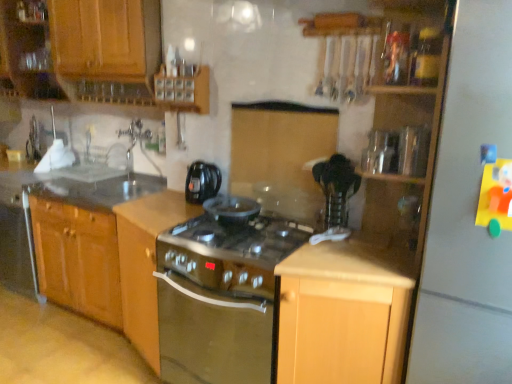
What do you see at coordinates (343, 313) in the screenshot?
I see `light wood cabinet at center, the 4th cabinetry when ordered from left to right` at bounding box center [343, 313].

Identify the location of wooden spice rack at upper center, which is the third cabinetry in left-to-right order. The height and width of the screenshot is (384, 512). (183, 90).

What is the approximate width of clear glass sink at upper left?

12.14 inches.

Identify the location of black plastic kettle at center. (202, 182).

Where is `smooth granite countertop at left`? The height and width of the screenshot is (384, 512). smooth granite countertop at left is located at coordinates (79, 185).

Locate an element on the screen. This screenshot has width=512, height=384. light wood cabinet at center, the first cabinetry in the right-to-left sequence is located at coordinates (343, 313).

In the scene shown: From the image's perspective, who appears lower, wooden cabinet at upper left, positioned as the first cabinetry in left-to-right order, or black plastic kettle at center?

black plastic kettle at center appears lower in the image.

Is wooden cabinet at upper left, which is the fourth cabinetry in right-to-left order, inside the boundaries of black plastic kettle at center, or outside?

wooden cabinet at upper left, which is the fourth cabinetry in right-to-left order, exists outside the volume of black plastic kettle at center.

From a real-world perspective, who is located higher, wooden cabinet at upper left, which is the fourth cabinetry in right-to-left order, or black plastic kettle at center?

From a 3D spatial view, wooden cabinet at upper left, which is the fourth cabinetry in right-to-left order, is above.

Between satin silver oven at center and black plastic kettle at center, which one has larger size?

With larger size is satin silver oven at center.

From a real-world perspective, is satin silver oven at center on black plastic kettle at center?

No, from a real-world perspective, satin silver oven at center is not over black plastic kettle at center

Is black plastic kettle at center at the back of satin silver oven at center?

No, satin silver oven at center is not facing away from black plastic kettle at center.

You are a GUI agent. You are given a task and a screenshot of the screen. Output one action in this format:
    pyautogui.click(x=<x>, y=<y>)
    Task: Click on the oven lying on the right of black plastic kettle at center
    The image size is (512, 384).
    Given the screenshot: What is the action you would take?
    pyautogui.click(x=222, y=298)

Are light wood cabinet at center, the 4th cabinetry when ordered from left to right, and clear plastic container at upper right, which is the first appliance in front-to-back order, making contact?

light wood cabinet at center, the 4th cabinetry when ordered from left to right, and clear plastic container at upper right, which is the first appliance in front-to-back order, are clearly separated.

Starting from the light wood cabinet at center, the first cabinetry in the right-to-left sequence, which appliance is the 2nd one to the right? Please provide its 2D coordinates.

[(413, 151)]

Is satin wood stove at center, which appears as the second cabinetry when viewed from the left, closer to camera compared to smooth granite countertop at left?

Yes, satin wood stove at center, which appears as the second cabinetry when viewed from the left, is closer to the viewer.

From the image's perspective, would you say satin wood stove at center, which ranks as the 3th cabinetry in right-to-left order, is positioned over smooth granite countertop at left?

No, from the image's perspective, satin wood stove at center, which ranks as the 3th cabinetry in right-to-left order, is not above smooth granite countertop at left.

From a real-world perspective, is satin wood stove at center, which appears as the second cabinetry when viewed from the left, physically above smooth granite countertop at left?

No, from a real-world perspective, satin wood stove at center, which appears as the second cabinetry when viewed from the left, is not on top of smooth granite countertop at left.

Between satin wood stove at center, which appears as the second cabinetry when viewed from the left, and smooth granite countertop at left, which one has less height?

smooth granite countertop at left is shorter.

How much distance is there between satin wood stove at center, which ranks as the 3th cabinetry in right-to-left order, and wooden cabinet at upper left, which is the fourth cabinetry in right-to-left order?

The distance of satin wood stove at center, which ranks as the 3th cabinetry in right-to-left order, from wooden cabinet at upper left, which is the fourth cabinetry in right-to-left order, is 35.46 inches.

From the image's perspective, which one is positioned higher, satin wood stove at center, which ranks as the 3th cabinetry in right-to-left order, or wooden cabinet at upper left, positioned as the first cabinetry in left-to-right order?

Result: From the image's view, wooden cabinet at upper left, positioned as the first cabinetry in left-to-right order, is above.

Is point (180, 207) less distant than point (14, 18)?

Yes, it is in front of point (14, 18).

Would you consider satin wood stove at center, which ranks as the 3th cabinetry in right-to-left order, to be distant from wooden cabinet at upper left, positioned as the first cabinetry in left-to-right order?

No, satin wood stove at center, which ranks as the 3th cabinetry in right-to-left order, is not far from wooden cabinet at upper left, positioned as the first cabinetry in left-to-right order.

Looking at their sizes, would you say satin wood stove at center, which ranks as the 3th cabinetry in right-to-left order, is wider or thinner than white matte refrigerator at right?

Clearly, satin wood stove at center, which ranks as the 3th cabinetry in right-to-left order, has less width compared to white matte refrigerator at right.

Which is less distant, (138, 216) or (444, 263)?

Positioned in front is point (444, 263).

Is satin wood stove at center, which ranks as the 3th cabinetry in right-to-left order, not near white matte refrigerator at right?

That's right, there is a large distance between satin wood stove at center, which ranks as the 3th cabinetry in right-to-left order, and white matte refrigerator at right.

Considering the positions of objects wooden spice rack at upper center, which is the 2th cabinetry from right to left, and satin wood stove at center, which ranks as the 3th cabinetry in right-to-left order, in the image provided, who is more to the left, wooden spice rack at upper center, which is the 2th cabinetry from right to left, or satin wood stove at center, which ranks as the 3th cabinetry in right-to-left order,?

satin wood stove at center, which ranks as the 3th cabinetry in right-to-left order.

Is wooden spice rack at upper center, which is the third cabinetry in left-to-right order, not close to satin wood stove at center, which ranks as the 3th cabinetry in right-to-left order?

No, wooden spice rack at upper center, which is the third cabinetry in left-to-right order, is not far away from satin wood stove at center, which ranks as the 3th cabinetry in right-to-left order.

Which object is closer to the camera taking this photo, wooden spice rack at upper center, which is the third cabinetry in left-to-right order, or satin wood stove at center, which appears as the second cabinetry when viewed from the left?

Positioned in front is satin wood stove at center, which appears as the second cabinetry when viewed from the left.

Between wooden spice rack at upper center, which is the third cabinetry in left-to-right order, and satin wood stove at center, which ranks as the 3th cabinetry in right-to-left order, which one has less height?

wooden spice rack at upper center, which is the third cabinetry in left-to-right order.

At what (x,y) coordinates should I click in order to perform the action: click on kitchen appliance on the right side of wooden cabinet at upper left, which is the fourth cabinetry in right-to-left order. Please return your answer as a coordinate pair (x, y). This screenshot has height=384, width=512. Looking at the image, I should click on (202, 182).

In order to click on oven in front of the black plastic kettle at center in this screenshot , I will do `click(222, 298)`.

Based on their spatial positions, is clear plastic container at upper right, which is the second appliance in back-to-front order, or wooden cabinet at upper left, which is the fourth cabinetry in right-to-left order, closer to black plastic kettle at center?

wooden cabinet at upper left, which is the fourth cabinetry in right-to-left order, is positioned closer to the anchor black plastic kettle at center.

Based on their spatial positions, is metallic silver toaster at upper right, the first appliance viewed from the back, or white matte refrigerator at right further from light wood cabinet at center, the 4th cabinetry when ordered from left to right?

The object further to light wood cabinet at center, the 4th cabinetry when ordered from left to right, is metallic silver toaster at upper right, the first appliance viewed from the back.

From the image, which object appears to be farther from satin silver oven at center, wooden cabinet at upper left, positioned as the first cabinetry in left-to-right order, or clear plastic container at upper right, which is the second appliance in back-to-front order?

wooden cabinet at upper left, positioned as the first cabinetry in left-to-right order, is further to satin silver oven at center.

Looking at the image, which one is located further to wooden spice rack at upper center, which is the 2th cabinetry from right to left, clear plastic container at upper right, which is the second appliance in back-to-front order, or white matte refrigerator at right?

Among the two, white matte refrigerator at right is located further to wooden spice rack at upper center, which is the 2th cabinetry from right to left.

Looking at the image, which one is located closer to smooth granite countertop at left, metallic silver toaster at upper right, placed as the second appliance when sorted from front to back, or black plastic kettle at center?

black plastic kettle at center is closer to smooth granite countertop at left.

Estimate the real-world distances between objects in this image. Which object is further from clear plastic container at upper right, which is the first appliance in front-to-back order, smooth granite countertop at left or wooden cabinet at upper left, positioned as the first cabinetry in left-to-right order?

Based on the image, smooth granite countertop at left appears to be further to clear plastic container at upper right, which is the first appliance in front-to-back order.

When comparing their distances from light wood cabinet at center, the first cabinetry in the right-to-left sequence, does smooth granite countertop at left or black plastic kettle at center seem closer?

The object closer to light wood cabinet at center, the first cabinetry in the right-to-left sequence, is black plastic kettle at center.

Which object lies further to the anchor point smooth granite countertop at left, wooden spice rack at upper center, which is the third cabinetry in left-to-right order, or black plastic kettle at center?

wooden spice rack at upper center, which is the third cabinetry in left-to-right order, is further to smooth granite countertop at left.

At what (x,y) coordinates should I click in order to perform the action: click on kitchen appliance located between wooden cabinet at upper left, which is the fourth cabinetry in right-to-left order, and clear plastic container at upper right, which is the second appliance in back-to-front order, in the left-right direction. Please return your answer as a coordinate pair (x, y). The width and height of the screenshot is (512, 384). Looking at the image, I should click on (202, 182).

You are a GUI agent. You are given a task and a screenshot of the screen. Output one action in this format:
    pyautogui.click(x=<x>, y=<y>)
    Task: Click on the kitchen appliance between wooden spice rack at upper center, which is the third cabinetry in left-to-right order, and satin silver oven at center in the up-down direction
    
    Given the screenshot: What is the action you would take?
    pyautogui.click(x=202, y=182)

Identify the location of kitchen appliance situated between wooden cabinet at upper left, positioned as the first cabinetry in left-to-right order, and metallic silver toaster at upper right, the first appliance viewed from the back, from left to right. (202, 182).

You are a GUI agent. You are given a task and a screenshot of the screen. Output one action in this format:
    pyautogui.click(x=<x>, y=<y>)
    Task: Click on the kitchen appliance between satin wood stove at center, which appears as the second cabinetry when viewed from the left, and metallic silver toaster at upper right, the first appliance viewed from the back, from left to right
    The image size is (512, 384).
    Given the screenshot: What is the action you would take?
    pyautogui.click(x=202, y=182)